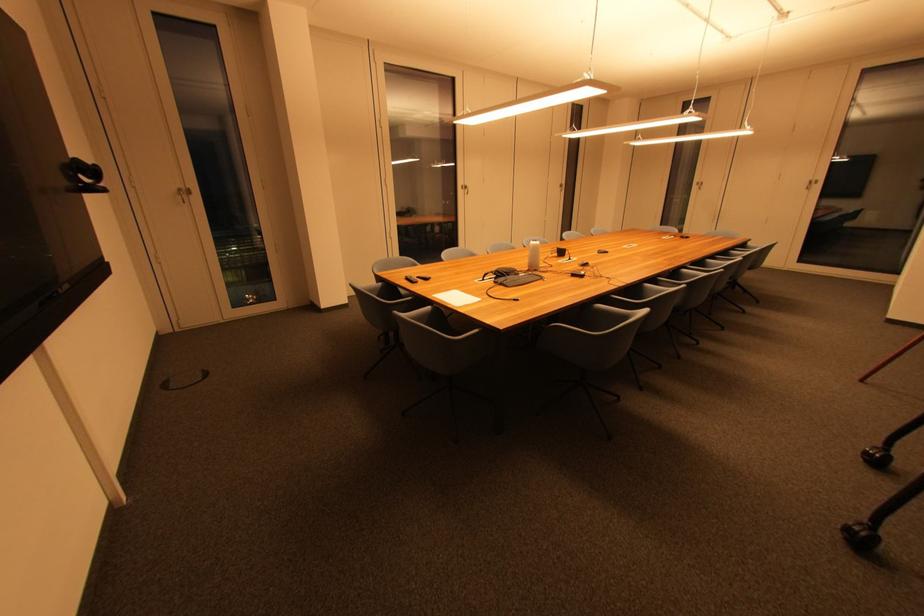
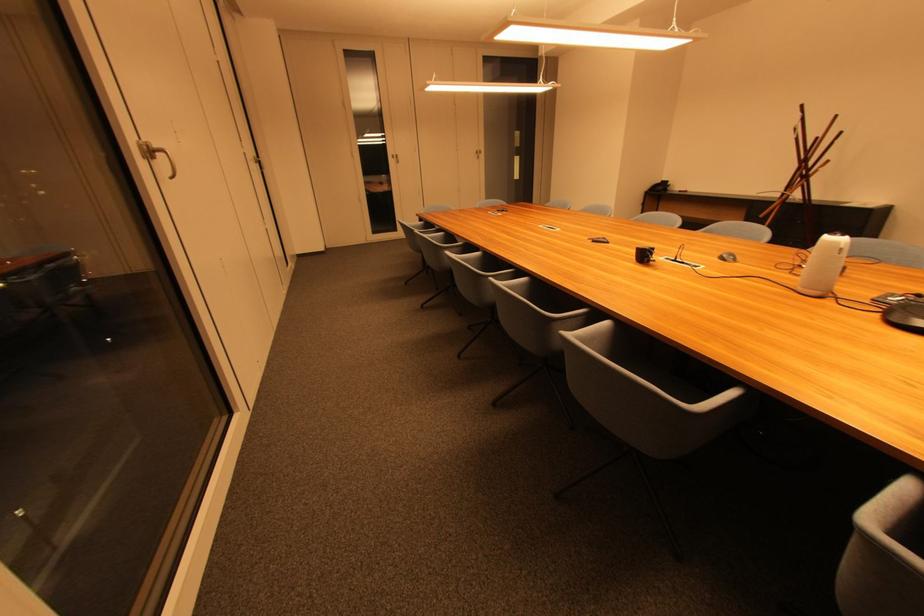
The point at (x=565, y=254) is marked in the first image. Where is the corresponding point in the second image?

(649, 257)